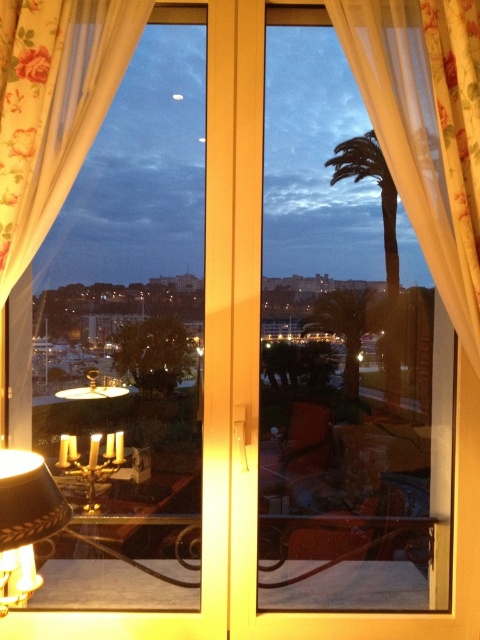
You are standing in the room and want to locate the matte black lampshade at lower left. According to its 2D coordinates, where would you find it in relation to the window?

The matte black lampshade at lower left is located at coordinates point [24,522], which is near the bottom left corner of the image, close to the window frame.

You are standing in the room and want to adjust the floral fabric curtain at right to let more light in. Which direction should you move it relative to the matte black lampshade at lower left?

The floral fabric curtain at right is to the right of the matte black lampshade at lower left. To let more light in, you should move the floral fabric curtain at right to the left, away from the window, so it is no longer blocking the light next to the matte black lampshade at lower left.

You are standing in the room looking through the window. You see the matte black lampshade at lower left and the green leafy palm tree at center. Which object is closer to the left side of the window?

The matte black lampshade at lower left is positioned on the left side of the green leafy palm tree at center, so it is closer to the left side of the window.